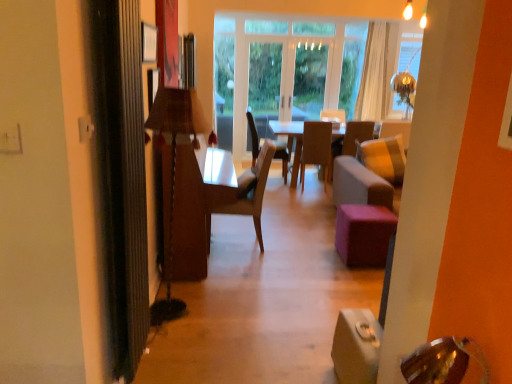
Question: Which direction should I rotate to look at wooden chair at center, arranged as the second chair when viewed from the right, — up or down?

Choices:
 (A) down
 (B) up

Answer: (B)

Question: Is brown leather chair at center, the third chair when ordered from left to right, positioned behind light gray fabric armchair at center?

Choices:
 (A) no
 (B) yes

Answer: (A)

Question: Does brown leather chair at center, positioned as the first chair in right-to-left order, have a lesser height compared to light gray fabric armchair at center?

Choices:
 (A) yes
 (B) no

Answer: (A)

Question: Can you confirm if brown leather chair at center, positioned as the first chair in right-to-left order, is smaller than light gray fabric armchair at center?

Choices:
 (A) no
 (B) yes

Answer: (A)

Question: From a real-world perspective, is brown leather chair at center, the second chair from the back, positioned over light gray fabric armchair at center based on gravity?

Choices:
 (A) yes
 (B) no

Answer: (B)

Question: From a real-world perspective, is brown leather chair at center, the third chair when ordered from left to right, under light gray fabric armchair at center?

Choices:
 (A) no
 (B) yes

Answer: (B)

Question: Does brown leather chair at center, which is the 2th chair from front to back, have a lesser width compared to light gray fabric armchair at center?

Choices:
 (A) yes
 (B) no

Answer: (B)

Question: Can you confirm if wooden chair at center, marked as the 1th chair in a back-to-front arrangement, is smaller than wooden lamp at left?

Choices:
 (A) no
 (B) yes

Answer: (A)

Question: Is wooden chair at center, arranged as the second chair when viewed from the right, far from wooden lamp at left?

Choices:
 (A) no
 (B) yes

Answer: (B)

Question: Can you confirm if wooden chair at center, which is counted as the third chair, starting from the front, is shorter than wooden lamp at left?

Choices:
 (A) no
 (B) yes

Answer: (B)

Question: Is wooden chair at center, positioned as the 2th chair in left-to-right order, to the right of wooden lamp at left from the viewer's perspective?

Choices:
 (A) no
 (B) yes

Answer: (B)

Question: Is wooden lamp at left a part of wooden chair at center, positioned as the 2th chair in left-to-right order?

Choices:
 (A) yes
 (B) no

Answer: (B)

Question: Is wooden chair at center, arranged as the second chair when viewed from the right, bigger than wooden lamp at left?

Choices:
 (A) no
 (B) yes

Answer: (B)

Question: Can you confirm if wooden lamp at left is taller than light brown wood chair at center, positioned as the first chair in left-to-right order?

Choices:
 (A) no
 (B) yes

Answer: (B)